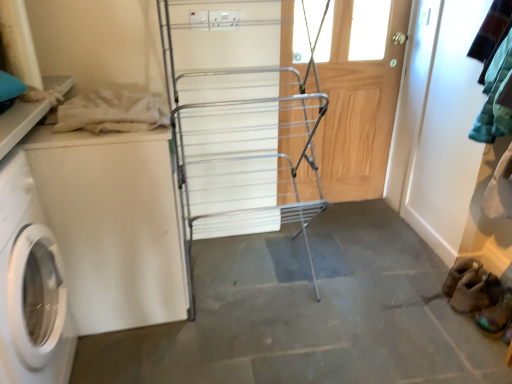
Locate an element on the screen. The image size is (512, 384). empty space that is to the right of silver metallic drying rack at center is located at coordinates (359, 284).